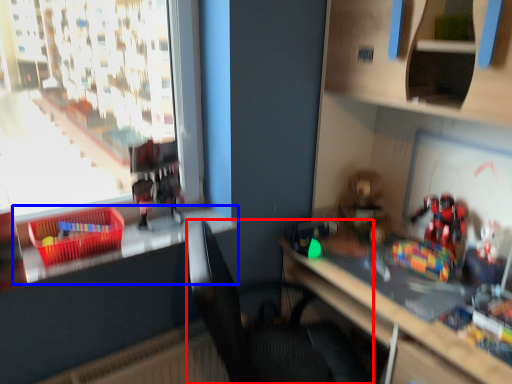
Question: Which point is closer to the camera, chair (highlighted by a red box) or window sill (highlighted by a blue box)?

Choices:
 (A) chair
 (B) window sill

Answer: (A)